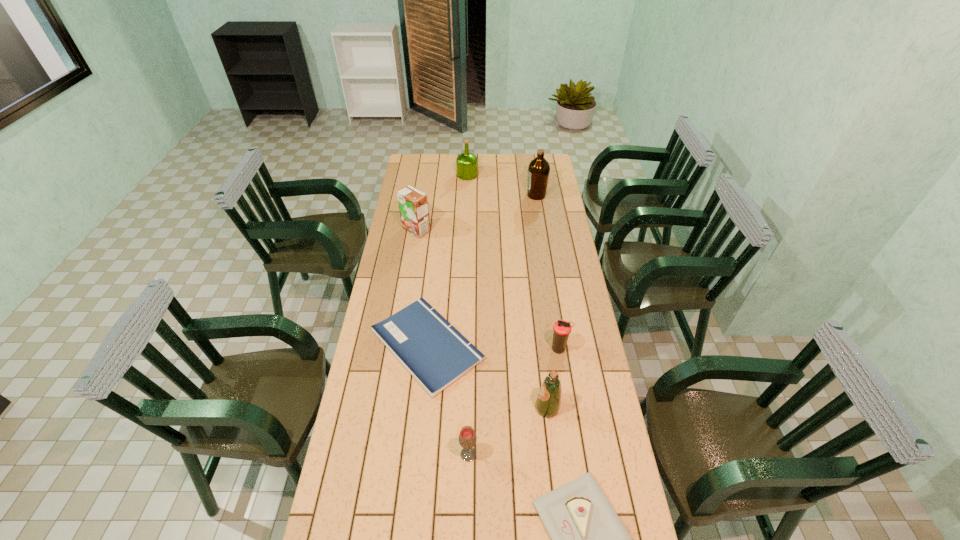
Locate an element on the screen. The width and height of the screenshot is (960, 540). free space that is in between the farthest object and the nearest olive oil is located at coordinates (507, 291).

Find the location of a particular element. The width and height of the screenshot is (960, 540). vacant area that lies between the tallest object and the nearest olive oil is located at coordinates (541, 301).

Find the location of a particular element. The width and height of the screenshot is (960, 540). empty space that is in between the thermos bottle and the second farthest object is located at coordinates (547, 272).

The height and width of the screenshot is (540, 960). I want to click on vacant region between the thermos bottle and the paperback book, so click(x=492, y=347).

The height and width of the screenshot is (540, 960). In order to click on object that is the second closest to the second shortest object in this screenshot , I will do `click(548, 402)`.

Identify which object is the fourth closest to the second farthest object. Please provide its 2D coordinates. Your answer should be formatted as a tuple, i.e. [(x, y)], where the tuple contains the x and y coordinates of a point satisfying the conditions above.

[(562, 328)]

Locate which olive oil is the third closest to the seventh tallest object. Please provide its 2D coordinates. Your answer should be formatted as a tuple, i.e. [(x, y)], where the tuple contains the x and y coordinates of a point satisfying the conditions above.

[(466, 163)]

Identify which olive oil is the third closest to the shortest object. Please provide its 2D coordinates. Your answer should be formatted as a tuple, i.e. [(x, y)], where the tuple contains the x and y coordinates of a point satisfying the conditions above.

[(466, 163)]

Locate an element on the screen. The image size is (960, 540). vacant position in the image that satisfies the following two spatial constraints: 1. on the label of the seventh nearest object; 2. on the front side of the thermos bottle is located at coordinates (561, 349).

Locate an element on the screen. vacant space that satisfies the following two spatial constraints: 1. on the straw side of the carton; 2. on the right side of the paperback book is located at coordinates (397, 345).